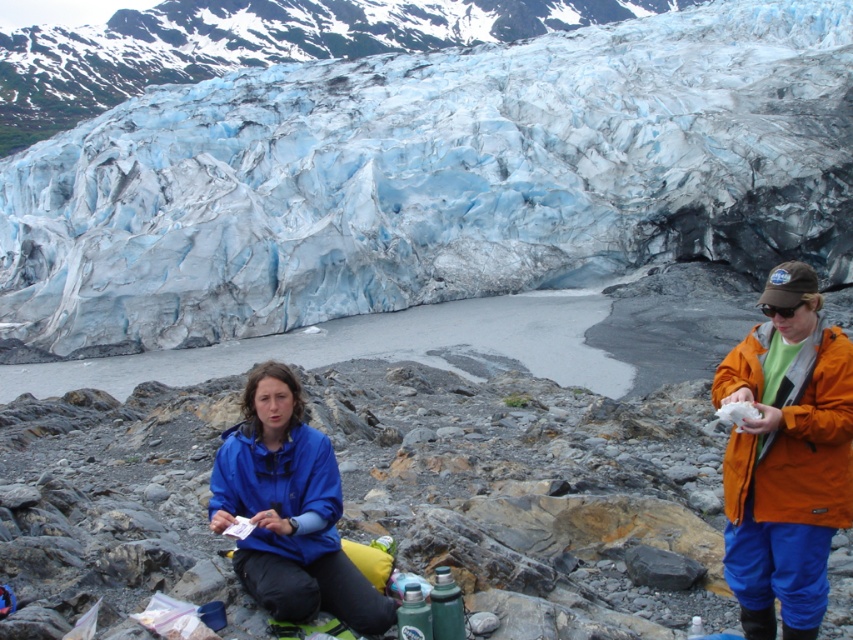
You are planning to take a photo of the blue ice glacier at center and the blue matte jacket at lower center. Which object will appear larger in the photo?

The blue ice glacier at center will appear larger in the photo because it is much taller than the blue matte jacket at lower center.

You are planning to take a photo of the blue ice glacier at center and the blue matte jacket at lower center. Which object should you focus on first if you want to capture both in a single frame without moving the camera?

The blue ice glacier at center is bigger than the blue matte jacket at lower center, so you should focus on the blue ice glacier at center first to ensure it fits properly in the frame before adjusting for the smaller jacket.